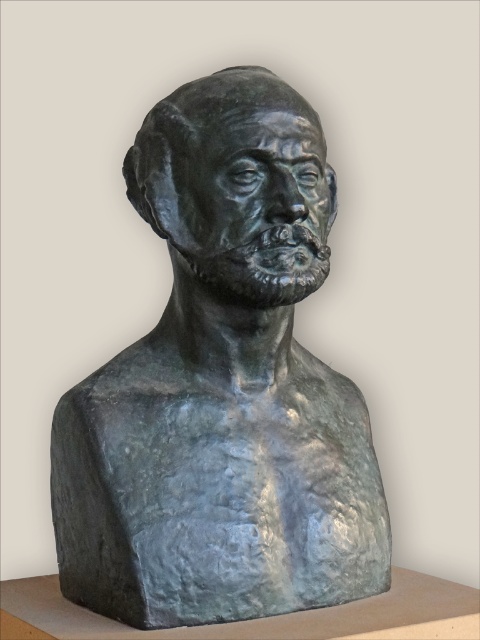
Question: Does bronze bust at center have a smaller size compared to bronze sculpture at center?

Choices:
 (A) yes
 (B) no

Answer: (B)

Question: Which point is farther to the camera?

Choices:
 (A) (295, 282)
 (B) (216, 200)

Answer: (B)

Question: From the image, what is the correct spatial relationship of bronze bust at center in relation to bronze sculpture at center?

Choices:
 (A) below
 (B) above

Answer: (A)

Question: Does bronze bust at center appear on the right side of bronze sculpture at center?

Choices:
 (A) no
 (B) yes

Answer: (B)